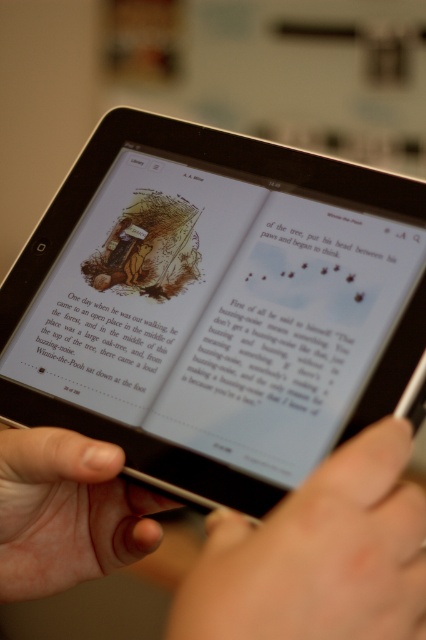
Question: Which point appears farthest from the camera in this image?

Choices:
 (A) (344, 630)
 (B) (77, 508)
 (C) (77, 355)

Answer: (B)

Question: Estimate the real-world distances between objects in this image. Which object is farther from the black glossy tablet at center?

Choices:
 (A) white paper at center
 (B) white paper text at center
 (C) smooth skin hand at lower left
 (D) smooth skin hand at lower center

Answer: (C)

Question: Does black glossy tablet at center have a larger size compared to white paper at center?

Choices:
 (A) yes
 (B) no

Answer: (A)

Question: Can you confirm if black glossy tablet at center is wider than smooth skin hand at lower center?

Choices:
 (A) no
 (B) yes

Answer: (B)

Question: Can you confirm if black glossy tablet at center is positioned above white paper text at center?

Choices:
 (A) no
 (B) yes

Answer: (B)

Question: Based on their relative distances, which object is nearer to the smooth skin hand at lower left?

Choices:
 (A) black glossy tablet at center
 (B) white paper text at center
 (C) white paper at center

Answer: (B)